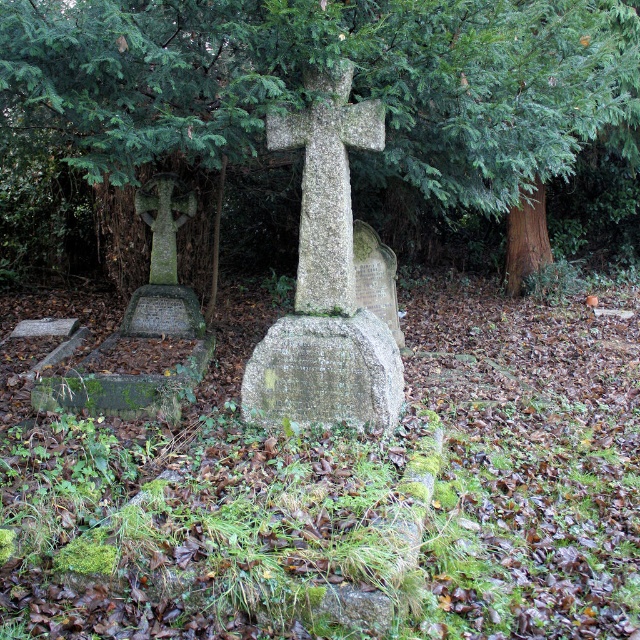
You are standing in the cemetery and want to take a photo of the green textured tree at center and the granite gravestone at center. Which object should you focus on first if you want to capture both in a single frame without moving the camera?

The green textured tree at center is taller than the granite gravestone at center, so you should focus on the granite gravestone at center first as it is closer to the camera, allowing both objects to be in the frame without moving the camera.

You are standing in the cemetery and want to locate the granite gravestone at center. According to the coordinates provided, where should you look?

The granite gravestone at center is located at point coordinates of (324, 372).

You are standing in the cemetery and want to take a photo of the green textured tree at center. Where should you position yourself to capture it in the frame?

The green textured tree at center is located at coordinates point (353, 83), so you should position yourself directly facing that point to capture it in the frame.